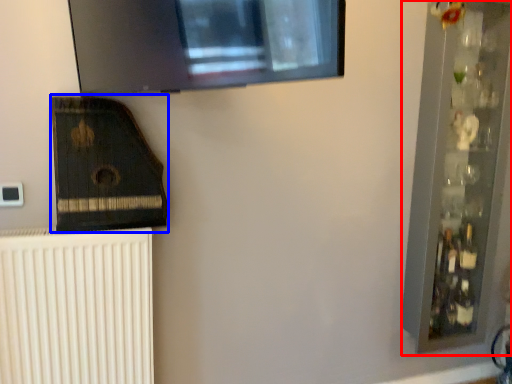
Question: Among these objects, which one is farthest to the camera, shelf (highlighted by a red box) or amplifier (highlighted by a blue box)?

Choices:
 (A) shelf
 (B) amplifier

Answer: (A)